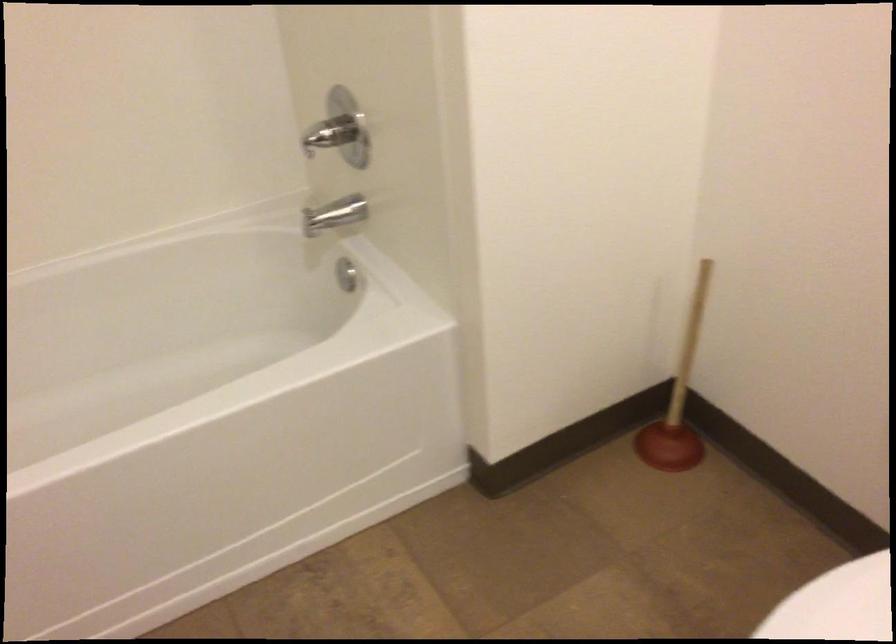
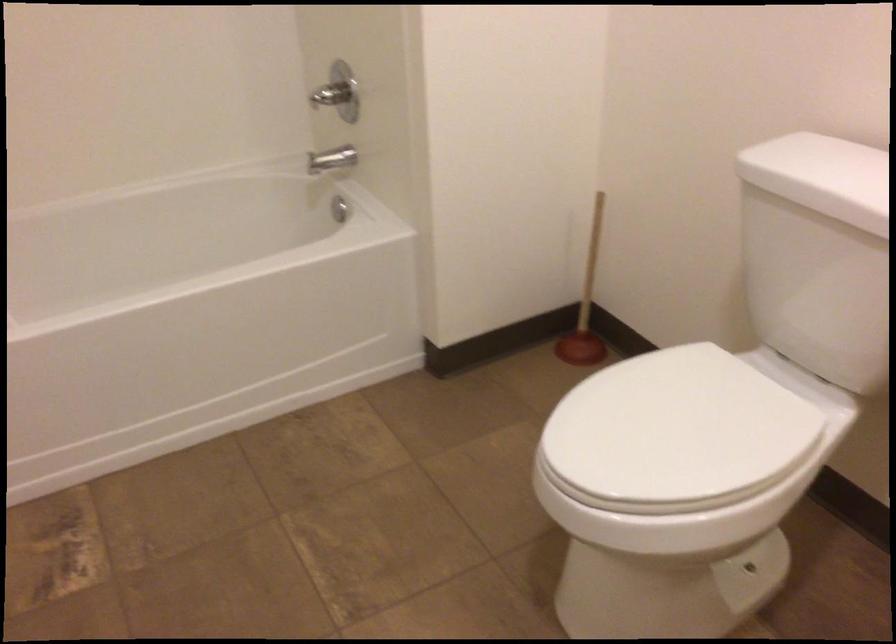
Question: The images are taken continuously from a first-person perspective. In which direction are you moving?

Choices:
 (A) Left
 (B) Right
 (C) Forward
 (D) Backward

Answer: (D)